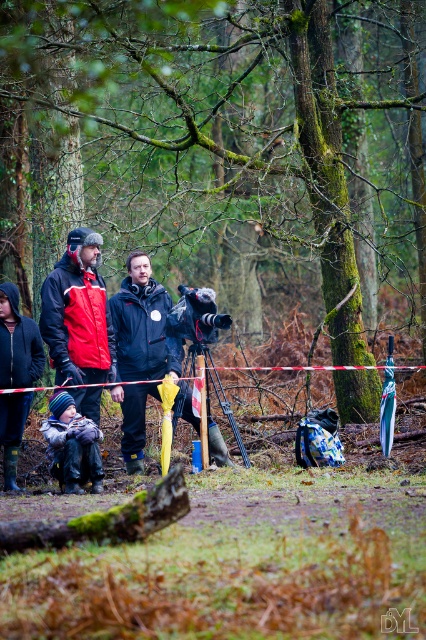
Question: Is dark blue fabric jacket at center smaller than metallic tripod at center?

Choices:
 (A) yes
 (B) no

Answer: (A)

Question: Which object is farther from the camera taking this photo?

Choices:
 (A) black matte jacket at center
 (B) metallic tripod at center

Answer: (B)

Question: Which point is closer to the camera?

Choices:
 (A) black matte jacket at center
 (B) dark blue fabric jacket at center
 (C) mossy bark log at lower center

Answer: (C)

Question: Which point is farther from the camera taking this photo?

Choices:
 (A) (106, 81)
 (B) (141, 444)

Answer: (A)

Question: Can you confirm if dark blue fabric jacket at center is thinner than knitted woolen hat at center?

Choices:
 (A) yes
 (B) no

Answer: (A)

Question: Can you confirm if green mossy tree at center is positioned below mossy bark log at lower center?

Choices:
 (A) no
 (B) yes

Answer: (A)